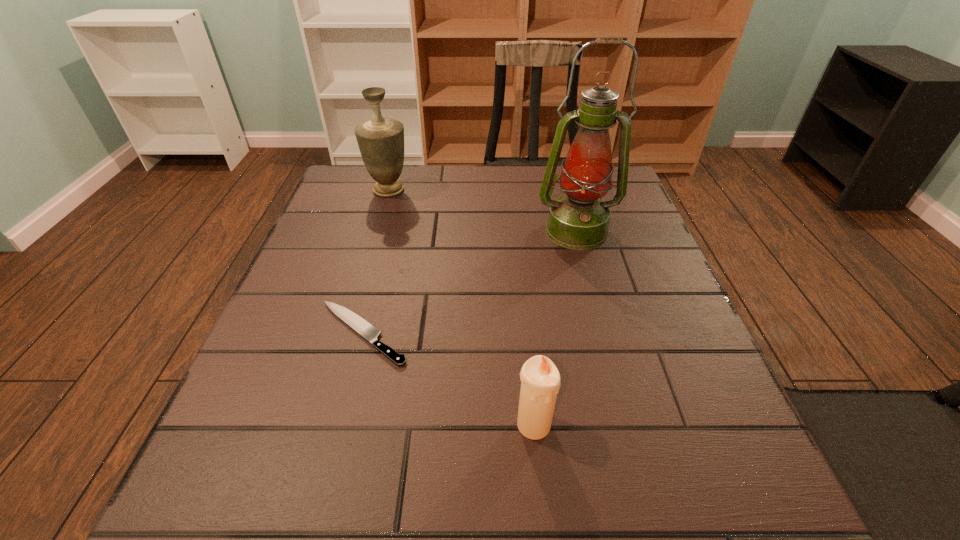
At what (x,y) coordinates should I click in order to perform the action: click on vacant space that is in between the oil lamp and the third farthest object. Please return your answer as a coordinate pair (x, y). This screenshot has height=540, width=960. Looking at the image, I should click on (469, 282).

Find the location of a particular element. Image resolution: width=960 pixels, height=540 pixels. vacant area that lies between the rightmost object and the urn is located at coordinates (483, 211).

Where is `free spot between the second object from right to left and the shortest object`? This screenshot has width=960, height=540. free spot between the second object from right to left and the shortest object is located at coordinates (448, 379).

Identify the location of the third closest object relative to the urn. (540, 379).

Where is `object that is the third closest to the second farthest object`? The width and height of the screenshot is (960, 540). object that is the third closest to the second farthest object is located at coordinates (540, 379).

This screenshot has width=960, height=540. I want to click on free space that satisfies the following two spatial constraints: 1. on the back side of the nearest object; 2. on the left side of the tallest object, so click(515, 231).

The image size is (960, 540). Identify the location of vacant region that satisfies the following two spatial constraints: 1. on the front side of the second tallest object; 2. on the left side of the candle. (320, 424).

At what (x,y) coordinates should I click in order to perform the action: click on free space that satisfies the following two spatial constraints: 1. on the front side of the third shortest object; 2. on the left side of the oil lamp. Please return your answer as a coordinate pair (x, y). The image size is (960, 540). Looking at the image, I should click on (376, 231).